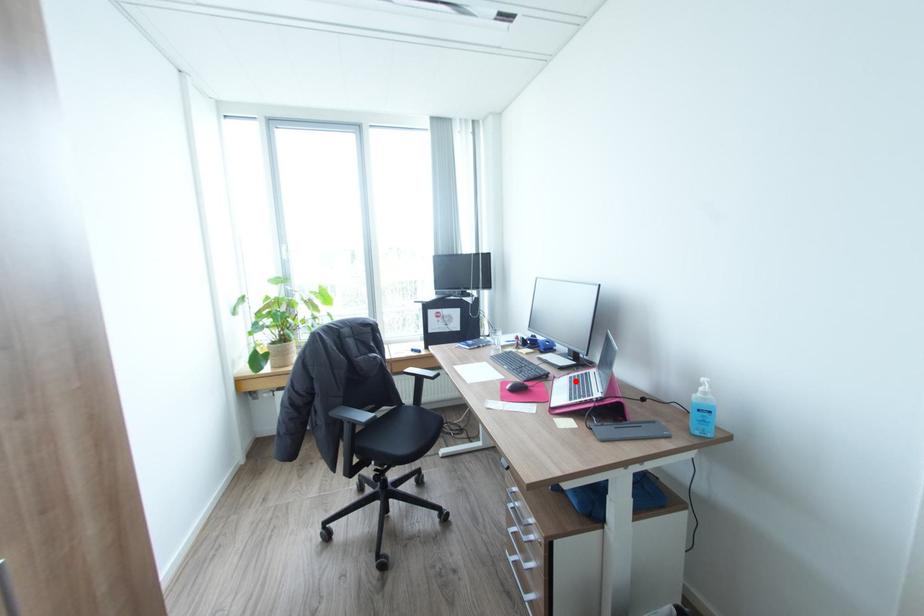
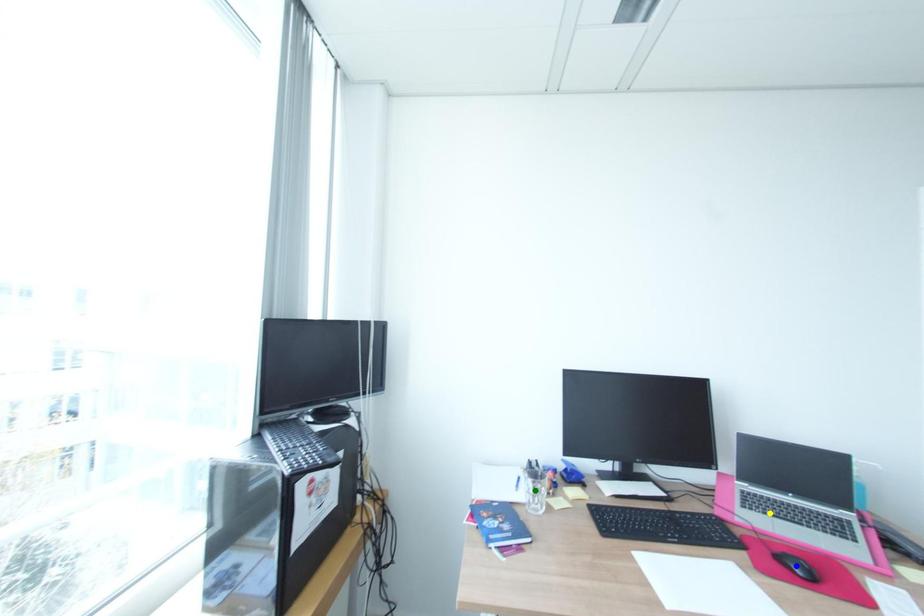
Question: I am providing you with two images of the same scene from different viewpoints. A red point is marked on the first image. You are given multiple points on the second image. Can you choose the point in image 2 that corresponds to the point in image 1?

Choices:
 (A) green point
 (B) yellow point
 (C) blue point

Answer: (B)